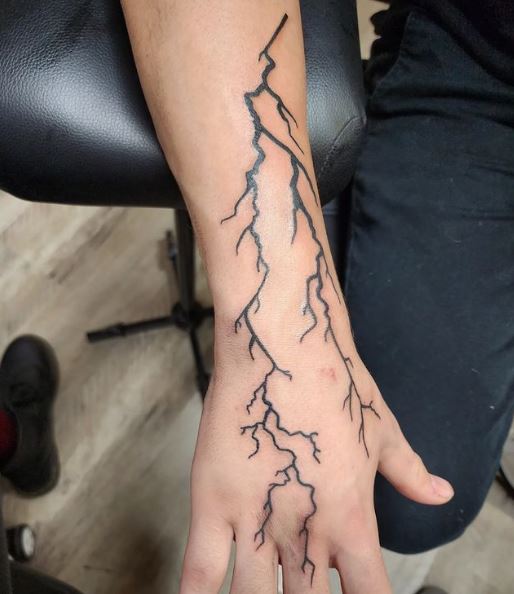
Where is `cushion`? Image resolution: width=514 pixels, height=594 pixels. cushion is located at coordinates (78, 53).